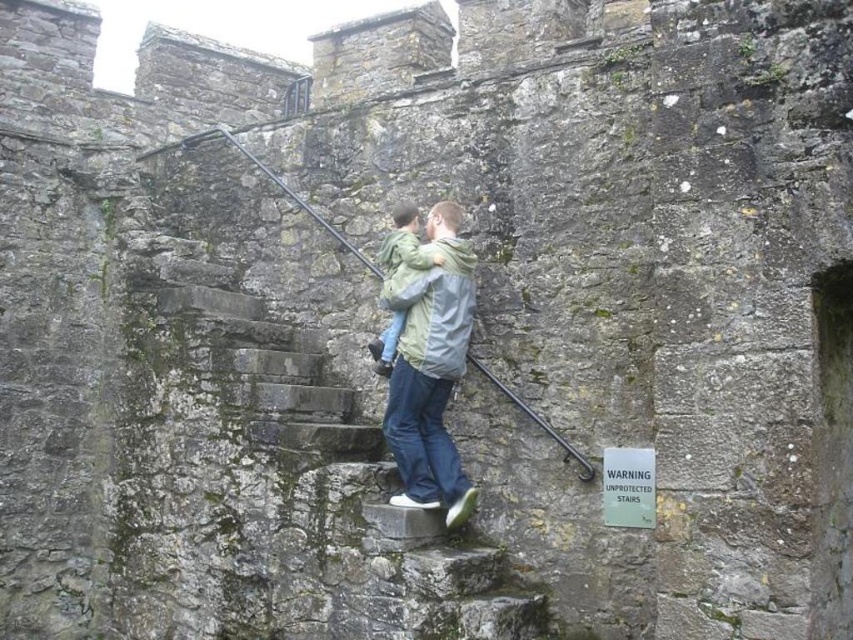
Question: Considering the relative positions of light green fabric boy at center and light green fabric at center in the image provided, where is light green fabric boy at center located with respect to light green fabric at center?

Choices:
 (A) left
 (B) right

Answer: (B)

Question: Can you confirm if gray stone stairs at center is positioned below light green fabric boy at center?

Choices:
 (A) yes
 (B) no

Answer: (A)

Question: Which object is closer to the camera taking this photo?

Choices:
 (A) light green fabric boy at center
 (B) gray stone stairs at center

Answer: (B)

Question: Among these points, which one is farthest from the camera?

Choices:
 (A) (425, 250)
 (B) (404, 500)

Answer: (A)

Question: Observing the image, what is the correct spatial positioning of gray stone stairs at center in reference to light green fabric boy at center?

Choices:
 (A) above
 (B) below

Answer: (B)

Question: Which object is positioned farthest from the light green fabric at center?

Choices:
 (A) light green fabric boy at center
 (B) gray stone stairs at center

Answer: (B)